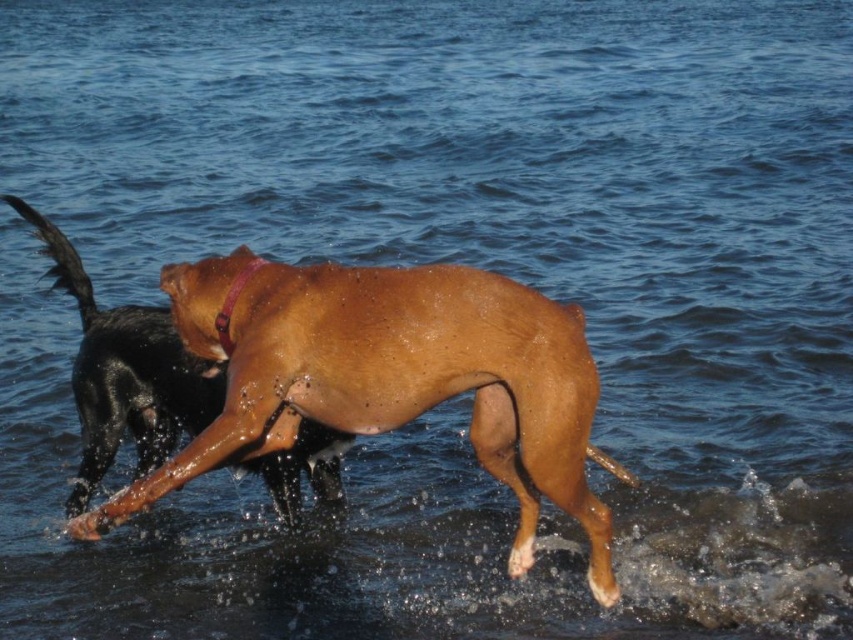
Is sandy brown fur at center wider than brown glossy dog at center?

Correct, the width of sandy brown fur at center exceeds that of brown glossy dog at center.

Is sandy brown fur at center positioned in front of brown glossy dog at center?

Yes, it is.

Describe the element at coordinates (392, 378) in the screenshot. I see `sandy brown fur at center` at that location.

The width and height of the screenshot is (853, 640). In order to click on sandy brown fur at center in this screenshot , I will do `click(392, 378)`.

Can you confirm if sandy brown fur at center is positioned above brown leather neckband at center?

No, sandy brown fur at center is not above brown leather neckband at center.

Is point (480, 348) more distant than point (234, 304)?

No, it is in front of (234, 304).

Identify the location of sandy brown fur at center. (392, 378).

Between point (86, 385) and point (239, 269), which one is positioned behind?

Positioned behind is point (86, 385).

Who is lower down, brown glossy dog at center or brown leather neckband at center?

brown glossy dog at center

Which is in front, point (165, 417) or point (262, 260)?

Point (262, 260) is more forward.

You are a GUI agent. You are given a task and a screenshot of the screen. Output one action in this format:
    pyautogui.click(x=<x>, y=<y>)
    Task: Click on the brown glossy dog at center
    This screenshot has height=640, width=853.
    Given the screenshot: What is the action you would take?
    pyautogui.click(x=125, y=372)